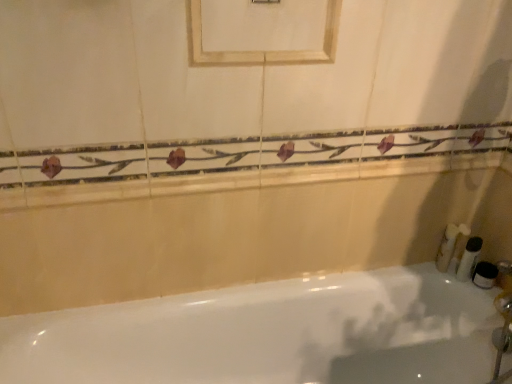
Question: From a real-world perspective, is white matte toothbrushes at right, which is the 2th toiletry in left-to-right order, above or below white glossy bathtub at lower center?

Choices:
 (A) below
 (B) above

Answer: (B)

Question: Considering the positions of white matte toothbrushes at right, which is the 2th toiletry in left-to-right order, and white glossy bathtub at lower center in the image, is white matte toothbrushes at right, which is the 2th toiletry in left-to-right order, wider or thinner than white glossy bathtub at lower center?

Choices:
 (A) thin
 (B) wide

Answer: (A)

Question: Which of these objects is positioned farthest from the white fluffy sponge at right, arranged as the 4th toiletry when viewed from the right?

Choices:
 (A) white glossy bathtub at lower center
 (B) white plastic bottle at right, the second toiletry from the right
 (C) porcelain tile balustrade at upper center
 (D) white matte jar at right, which is the first toiletry from right to left
 (E) white matte toothbrushes at right, which is the third toiletry from right to left

Answer: (A)

Question: Based on their relative distances, which object is nearer to the white matte jar at right, the fourth toiletry from the left?

Choices:
 (A) white fluffy sponge at right, which is counted as the first toiletry, starting from the left
 (B) white plastic bottle at right, acting as the third toiletry starting from the left
 (C) porcelain tile balustrade at upper center
 (D) white matte toothbrushes at right, which is the 2th toiletry in left-to-right order
 (E) white glossy bathtub at lower center

Answer: (B)